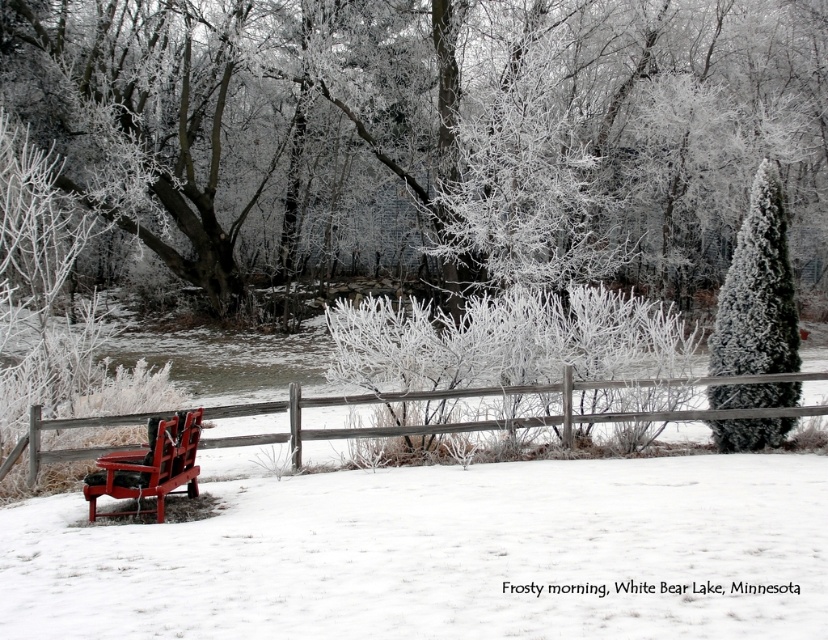
You are a photographer planning to take a winter landscape photo. You want to include both the green textured evergreen at right and the matte red park bench at lower left in your shot. Based on their positions, which object should you place closer to the left side of your frame?

The matte red park bench at lower left is positioned to the left of the green textured evergreen at right, so to include both in your shot, you should place the matte red park bench at lower left closer to the left side of your frame.

You are planning to take a photo of the winter scene at White Bear Lake. You want to ensure both the frosty branches at center and the wooden at left are clearly visible in your shot. Which object should you focus on first to ensure both are in frame?

The frosty branches at center is larger in size than wooden at left, so focusing on the larger frosty branches at center first will help ensure both objects are within the frame.

You are standing at the center of the image and want to walk towards the green textured evergreen at right and the matte red park bench at lower left. Which object will you encounter first?

The matte red park bench at lower left is encountered first because it is closer to the viewer than the green textured evergreen at right, which is positioned behind it.